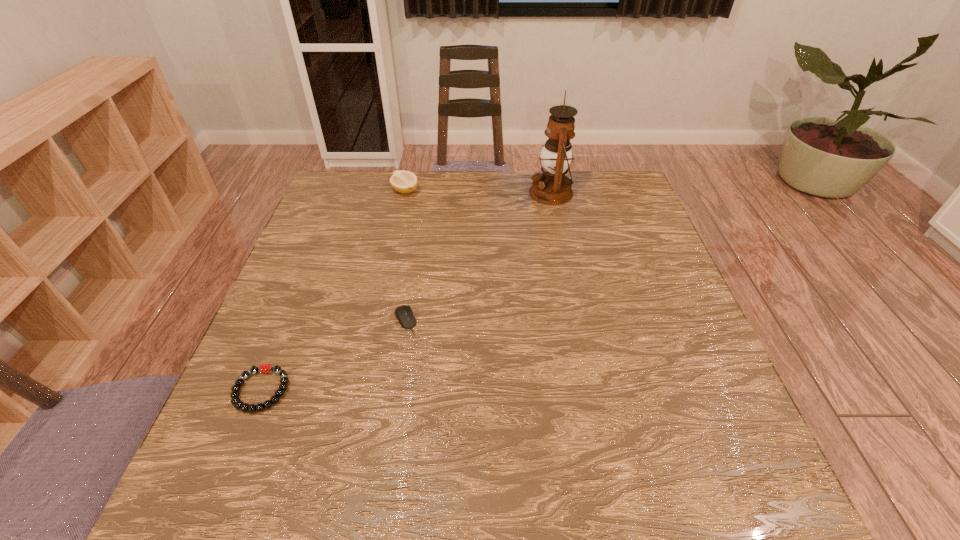
I want to click on vacant space at the far left corner, so click(367, 193).

In the image, there is a desktop. At what (x,y) coordinates should I click in order to perform the action: click on vacant space at the near left corner. Please return your answer as a coordinate pair (x, y). The image size is (960, 540). Looking at the image, I should click on (298, 456).

Where is `free spot at the near right corner of the desktop`? free spot at the near right corner of the desktop is located at coordinates (729, 509).

Image resolution: width=960 pixels, height=540 pixels. I want to click on vacant space in between the nearest object and the tallest object, so click(x=406, y=292).

The width and height of the screenshot is (960, 540). What are the coordinates of `free space between the leftmost object and the third tallest object` in the screenshot? It's located at (333, 355).

The width and height of the screenshot is (960, 540). I want to click on free space between the third tallest object and the lemon, so click(405, 256).

At what (x,y) coordinates should I click in order to perform the action: click on empty location between the second tallest object and the second nearest object. Please return your answer as a coordinate pair (x, y). Looking at the image, I should click on (405, 256).

Locate an element on the screen. This screenshot has width=960, height=540. free space between the lemon and the shortest object is located at coordinates (333, 291).

The width and height of the screenshot is (960, 540). Find the location of `free area in between the third shortest object and the second shortest object`. free area in between the third shortest object and the second shortest object is located at coordinates (405, 256).

The width and height of the screenshot is (960, 540). I want to click on free space between the third shortest object and the tallest object, so click(x=478, y=192).